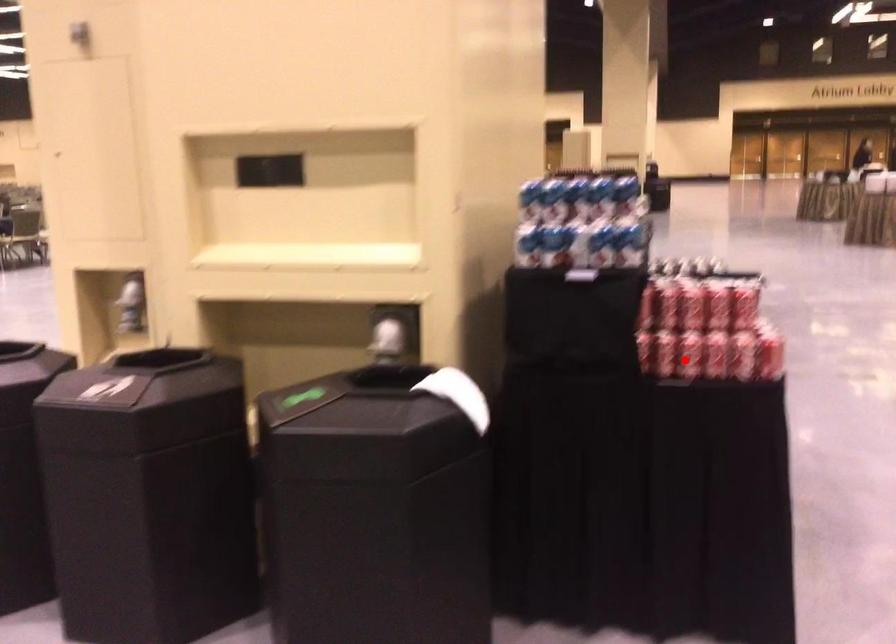
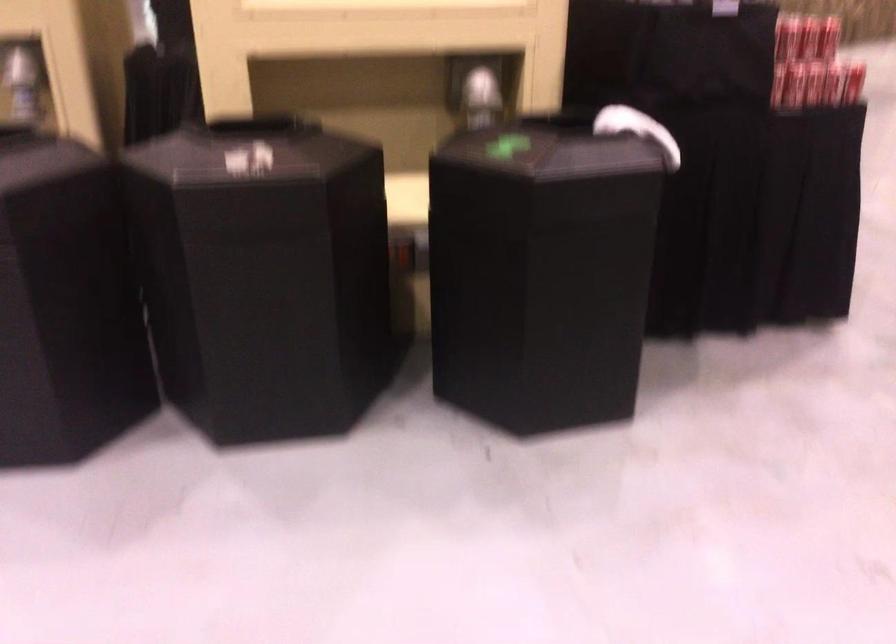
Question: I am providing you with two images of the same scene from different viewpoints. A red point is marked on the first image. Is the red point's position out of view in image 2?

Choices:
 (A) Yes
 (B) No

Answer: (B)